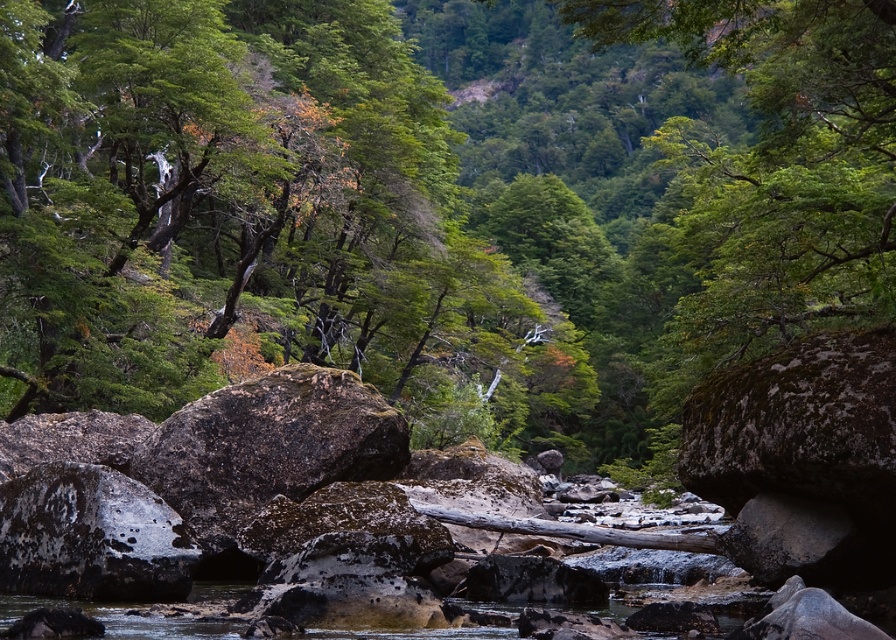
Is mossy granite boulder at center-left above speckled gray rock at center-left?

Indeed, mossy granite boulder at center-left is positioned over speckled gray rock at center-left.

Can you confirm if mossy granite boulder at center-left is taller than speckled gray rock at center-left?

Indeed, mossy granite boulder at center-left has a greater height compared to speckled gray rock at center-left.

Between point (234, 499) and point (70, 556), which one is positioned in front?

Point (70, 556) is in front.

The image size is (896, 640). I want to click on mossy granite boulder at center-left, so click(x=268, y=445).